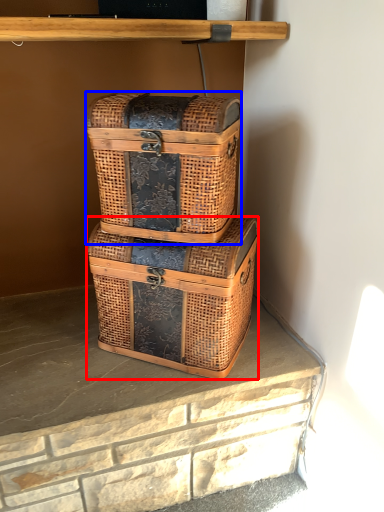
Question: Which object appears closest to the camera in this image, box (highlighted by a red box) or box (highlighted by a blue box)?

Choices:
 (A) box
 (B) box

Answer: (B)